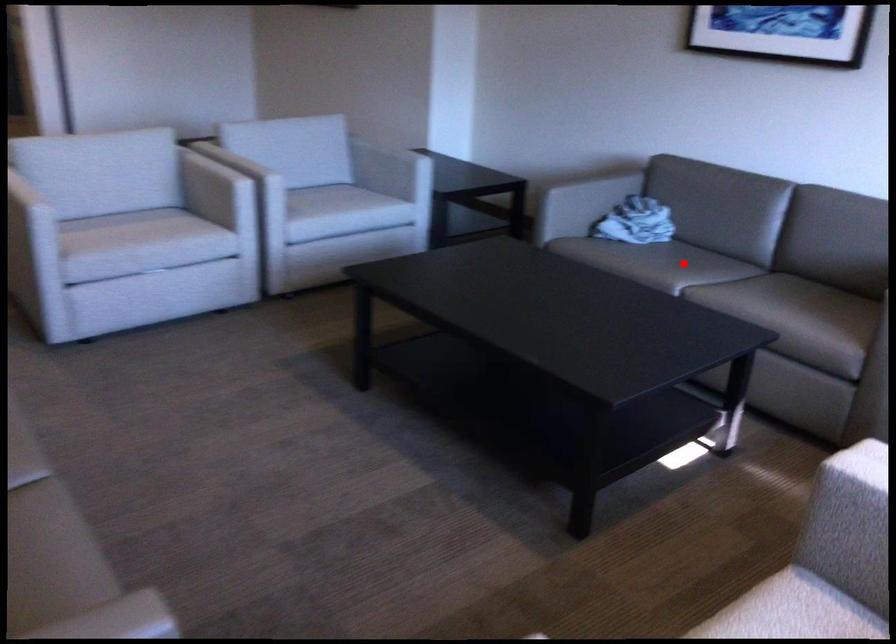
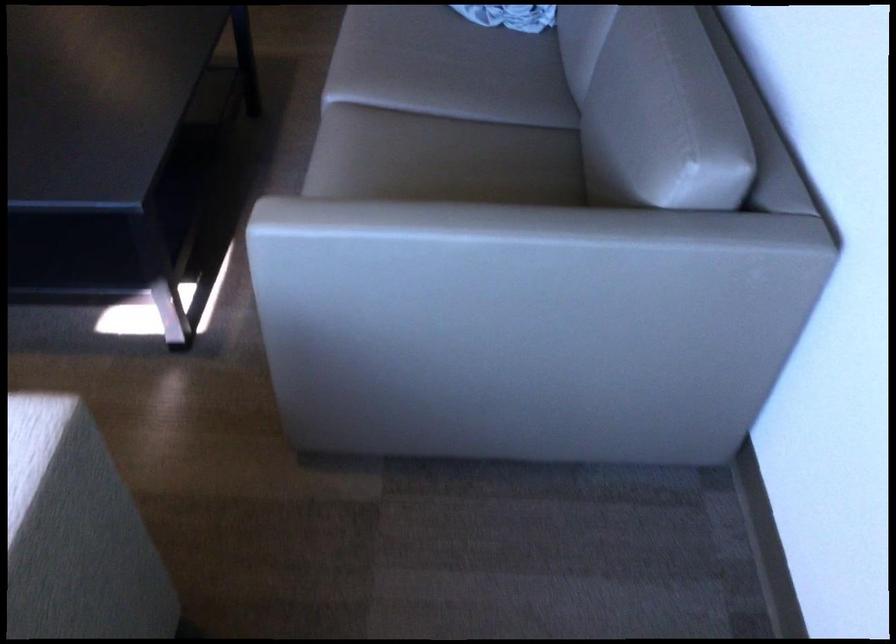
Question: I am providing you with two images of the same scene from different viewpoints. In image1, a red point is highlighted. Considering the same 3D point in image2, which of the following is correct?

Choices:
 (A) It is closer
 (B) It is farther

Answer: (A)